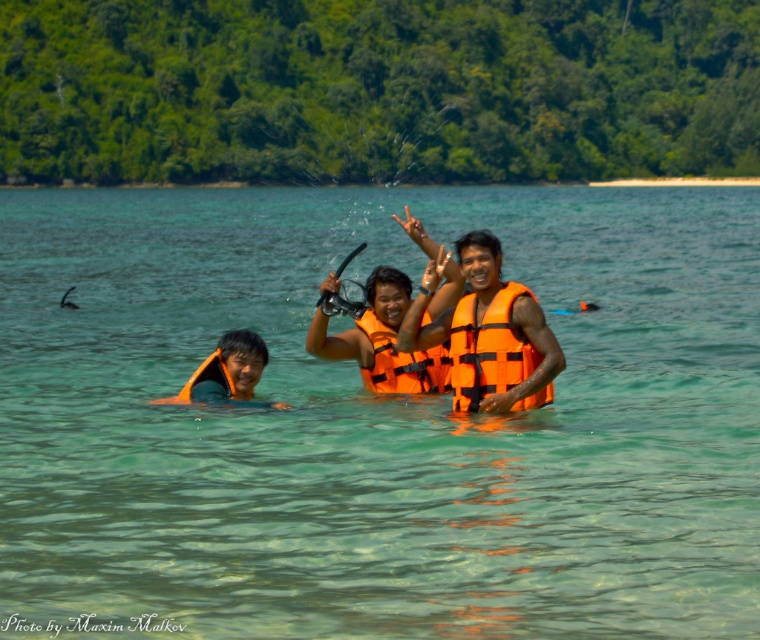
Question: Is orange life vest at center in front of orange matte life jacket at lower left?

Choices:
 (A) yes
 (B) no

Answer: (A)

Question: Is orange life vest at center wider than orange matte life jacket at center?

Choices:
 (A) no
 (B) yes

Answer: (B)

Question: Estimate the real-world distances between objects in this image. Which object is farther from the orange life vest at center?

Choices:
 (A) orange matte life jacket at center
 (B) orange life vest at left
 (C) orange matte life jacket at lower left

Answer: (C)

Question: Estimate the real-world distances between objects in this image. Which object is farther from the orange life vest at left?

Choices:
 (A) orange life jacket at center
 (B) orange life vest at center

Answer: (B)

Question: Can you confirm if orange life vest at center is thinner than orange matte life jacket at center?

Choices:
 (A) no
 (B) yes

Answer: (A)

Question: Estimate the real-world distances between objects in this image. Which object is closer to the orange matte life jacket at lower left?

Choices:
 (A) orange matte life jacket at center
 (B) clear water at center
 (C) orange life vest at left

Answer: (C)